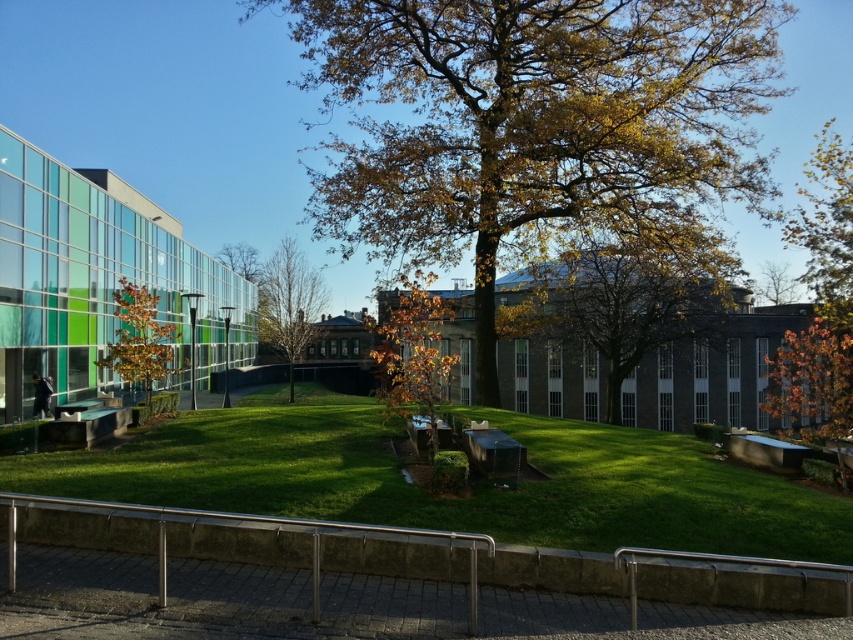
Does golden leafy tree at center appear under green leafy tree at left?

Yes.

Does golden leafy tree at center have a greater width compared to green leafy tree at left?

Incorrect, golden leafy tree at center's width does not surpass green leafy tree at left's.

This screenshot has width=853, height=640. Identify the location of golden leafy tree at center. (413, 355).

Is green grassy at center further to camera compared to green leafy tree at left?

No, green grassy at center is closer to the viewer.

Describe the element at coordinates (453, 499) in the screenshot. I see `green grassy at center` at that location.

You are a GUI agent. You are given a task and a screenshot of the screen. Output one action in this format:
    pyautogui.click(x=<x>, y=<y>)
    Task: Click on the green grassy at center
    Image resolution: width=853 pixels, height=640 pixels.
    Given the screenshot: What is the action you would take?
    pyautogui.click(x=453, y=499)

Can you confirm if golden textured tree at center is positioned to the right of orange leafy tree at right?

No, golden textured tree at center is not to the right of orange leafy tree at right.

Between golden textured tree at center and orange leafy tree at right, which one appears on the right side from the viewer's perspective?

Positioned to the right is orange leafy tree at right.

Find the location of a particular element. Image resolution: width=853 pixels, height=640 pixels. golden textured tree at center is located at coordinates [x=625, y=296].